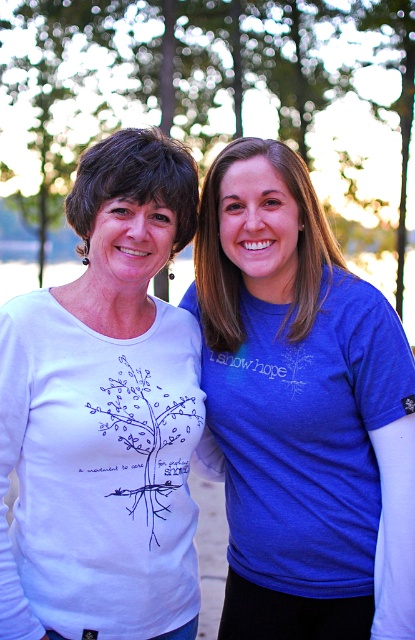
You are a photographer reviewing the image of two people in a garden. You notice two shirts in the scene. Which shirt, the matte white shirt at left or the white matte shirt at left, is positioned to the right?

The matte white shirt at left is positioned to the right of the white matte shirt at left.

You are standing at the point marked by the coordinates point (114,618). You want to take a photo of the two people in the scene. Will you be able to capture both individuals in your photo if your camera has a standard 50mm lens with a 46 degree field of view?

The point (114,618) is 10.26 feet away from the viewer. With a standard 50mm lens and a 46 degree field of view, the camera can capture subjects within this angle. Since both individuals are in the foreground and the point is positioned to include them, yes, both people can be captured in the photo.

You are a photographer who wants to capture a clear shot of both the white matte shirt at left and the white matte tree at center. Since the background is blurred, will the tree be visible behind the shirt?

The white matte shirt at left is in front of the white matte tree at center, so the tree will not be visible behind the shirt in the photo.